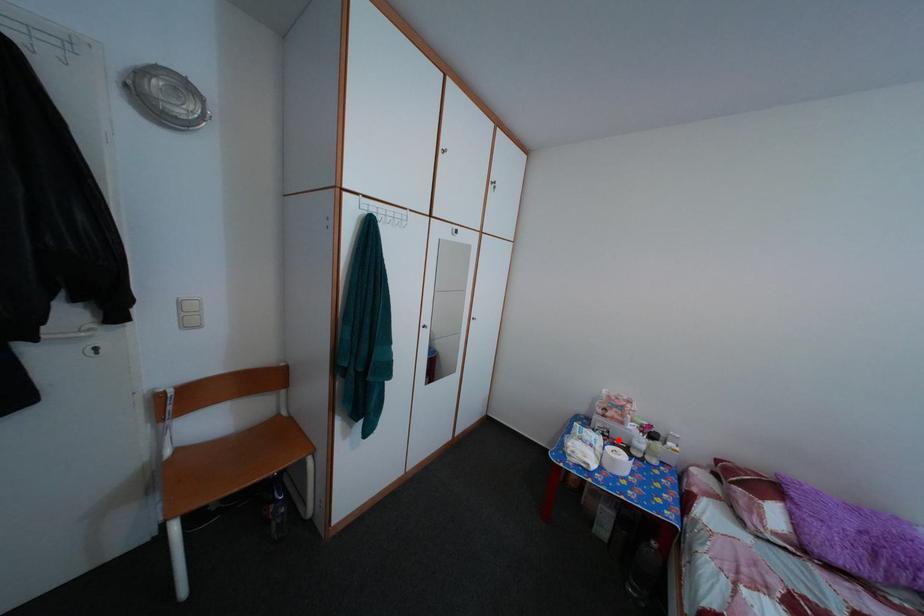
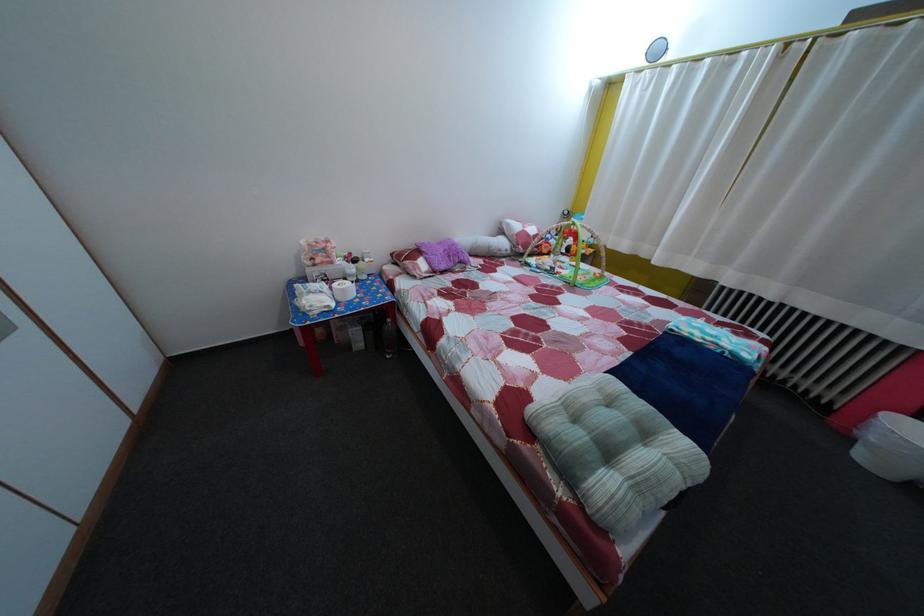
Question: I am providing you with two images of the same scene from different viewpoints. Image1 has a red point marked. In image2, the corresponding 3D location appears at what relative position? Reply with the corresponding letter.

Choices:
 (A) Closer
 (B) Farther

Answer: (A)